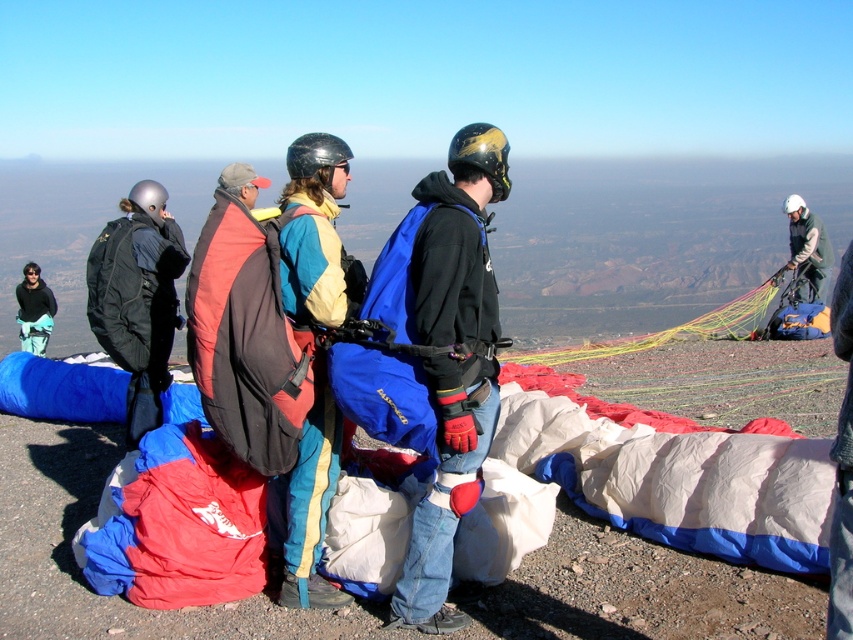
You are a photographer trying to capture a photo of the matte blue and yellow jacket at center and the green fabric parachute at upper right. Which object should you focus on first if you want to ensure both are in sharp focus, considering their sizes in the frame?

The matte blue and yellow jacket at center is shorter than the green fabric parachute at upper right, so you should focus on the green fabric parachute at upper right first to ensure both are in sharp focus.

In the scene shown: Based on the coordinates provided, where exactly is the matte blue and yellow jacket at center located in the image?

The matte blue and yellow jacket at center is located at the coordinates point [317,236].

You are a paragliding instructor assessing the setup. You see the blue fabric parachute at center and the brushed metal helmet at upper left. Which object is wider?

The blue fabric parachute at center is wider than the brushed metal helmet at upper left.